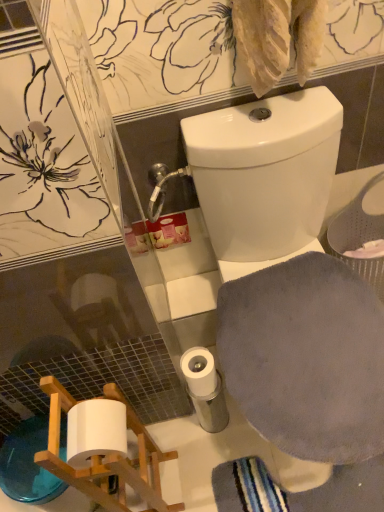
Question: Are white glossy toilet at upper center and gray soft cloth at lower right far apart?

Choices:
 (A) no
 (B) yes

Answer: (A)

Question: From a real-world perspective, is white glossy toilet at upper center beneath gray soft cloth at lower right?

Choices:
 (A) no
 (B) yes

Answer: (B)

Question: From the image's perspective, would you say white glossy toilet at upper center is shown under gray soft cloth at lower right?

Choices:
 (A) yes
 (B) no

Answer: (B)

Question: Is white glossy toilet at upper center placed right next to gray soft cloth at lower right?

Choices:
 (A) yes
 (B) no

Answer: (B)

Question: Is white glossy toilet at upper center closer to camera compared to gray soft cloth at lower right?

Choices:
 (A) yes
 (B) no

Answer: (A)

Question: From the image's perspective, relative to white matte toilet paper at lower center, is white glossy toilet at upper center above or below?

Choices:
 (A) below
 (B) above

Answer: (B)

Question: Relative to white matte toilet paper at lower center, is white glossy toilet at upper center in front or behind?

Choices:
 (A) front
 (B) behind

Answer: (A)

Question: Looking at their shapes, would you say white glossy toilet at upper center is wider or thinner than white matte toilet paper at lower center?

Choices:
 (A) thin
 (B) wide

Answer: (B)

Question: Does point (307, 223) appear closer or farther from the camera than point (198, 356)?

Choices:
 (A) closer
 (B) farther

Answer: (B)

Question: Is gray soft cloth at lower right inside or outside of white glossy toilet at upper center?

Choices:
 (A) inside
 (B) outside

Answer: (A)

Question: In the image, is gray soft cloth at lower right on the left side or the right side of white glossy toilet at upper center?

Choices:
 (A) right
 (B) left

Answer: (A)

Question: Is gray soft cloth at lower right taller or shorter than white glossy toilet at upper center?

Choices:
 (A) short
 (B) tall

Answer: (A)

Question: Looking at their shapes, would you say gray soft cloth at lower right is wider or thinner than white glossy toilet at upper center?

Choices:
 (A) wide
 (B) thin

Answer: (B)

Question: Considering their positions, is white matte toilet paper at lower center located in front of or behind white glossy toilet at upper center?

Choices:
 (A) front
 (B) behind

Answer: (B)

Question: Is white matte toilet paper at lower center wider or thinner than white glossy toilet at upper center?

Choices:
 (A) wide
 (B) thin

Answer: (B)